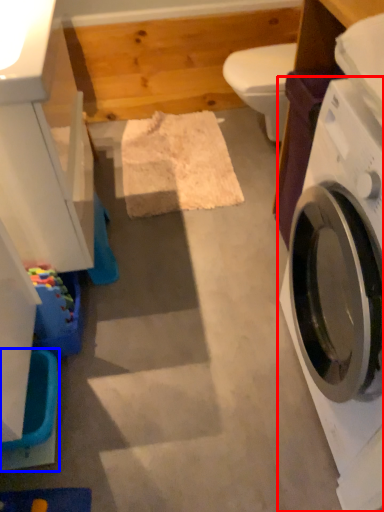
Question: Which point is further to the camera, washing machine (highlighted by a red box) or washer (highlighted by a blue box)?

Choices:
 (A) washing machine
 (B) washer

Answer: (B)